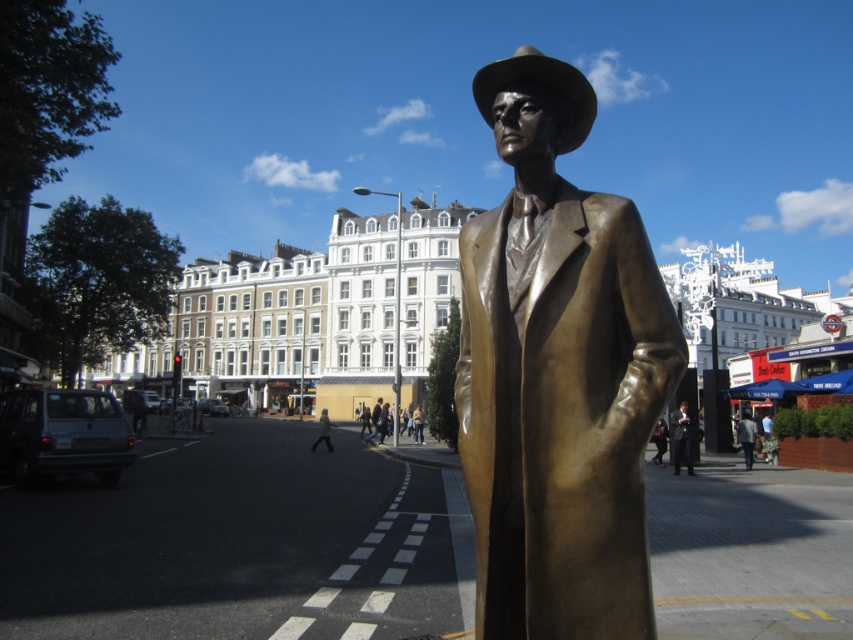
Is shiny bronze statue at center positioned behind shiny bronze fedora at center?

No.

Is shiny bronze statue at center below shiny bronze fedora at center?

Yes, shiny bronze statue at center is below shiny bronze fedora at center.

Is point (544, 285) positioned before point (498, 60)?

Yes, point (544, 285) is closer to viewer.

Locate an element on the screen. shiny bronze statue at center is located at coordinates (556, 374).

Does shiny bronze statue at center have a greater height compared to light gray knit sweater at center?

A: Yes, shiny bronze statue at center is taller than light gray knit sweater at center.

This screenshot has height=640, width=853. What do you see at coordinates (556, 374) in the screenshot?
I see `shiny bronze statue at center` at bounding box center [556, 374].

Find the location of `shiny bronze statue at center`. shiny bronze statue at center is located at coordinates (556, 374).

Identify the location of shiny bronze statue at center. (556, 374).

Between shiny bronze fedora at center and dark gray suit at center, which one appears on the left side from the viewer's perspective?

From the viewer's perspective, shiny bronze fedora at center appears more on the left side.

Is shiny bronze fedora at center smaller than dark gray suit at center?

No.

Does point (561, 81) come behind point (749, 426)?

No, (561, 81) is closer to viewer.

Where is `shiny bronze fedora at center`? shiny bronze fedora at center is located at coordinates (541, 83).